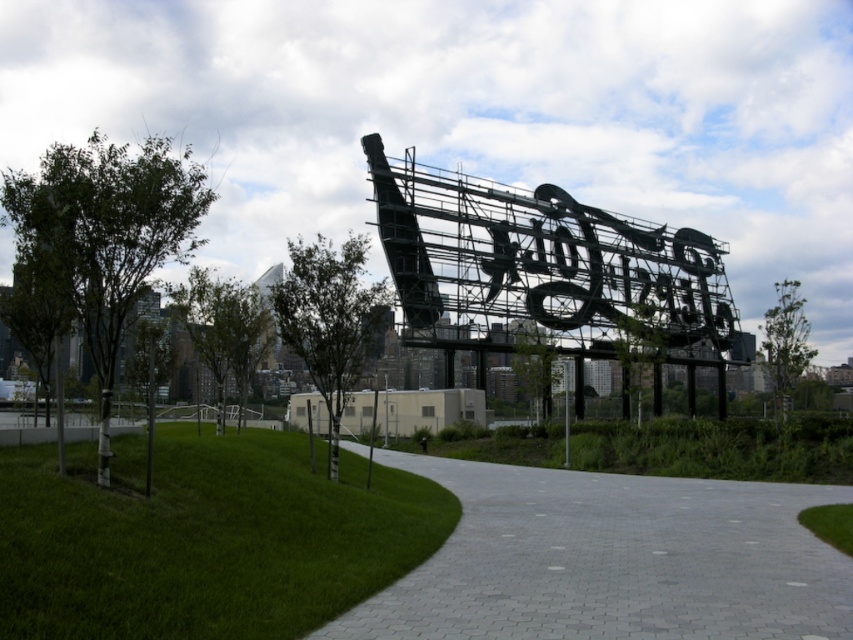
You are a gardener planning to mow the green grass at lower center and the gray paver path at center. Which area requires a smaller lawnmower to accommodate its size?

The gray paver path at center requires a smaller lawnmower because it is smaller than the green grass at lower center.

You are standing on the paved pathway and want to walk towards the black wireframe sculpture. Which direction should you walk to first pass the green grass at lower left before reaching the green grass at lower center?

You should walk towards the right because the green grass at lower left is in front of the green grass at lower center, meaning the path curves to the right, allowing you to first pass the green grass at lower left before reaching the green grass at lower center.